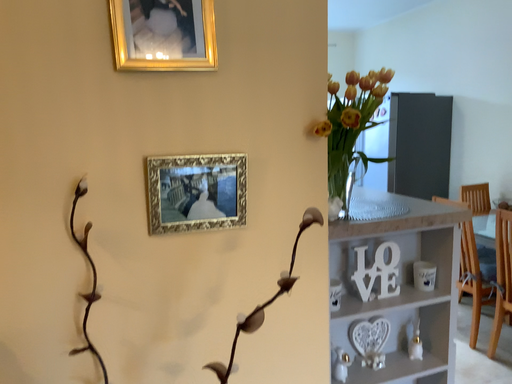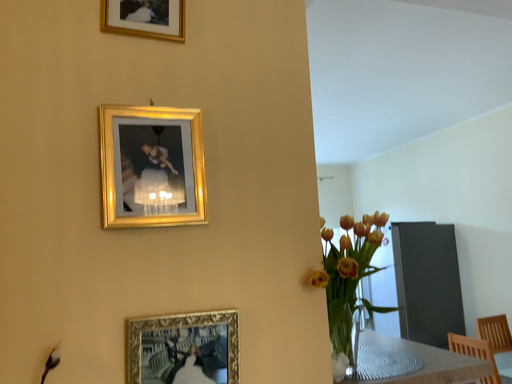
Question: How did the camera likely rotate when shooting the video?

Choices:
 (A) rotated downward
 (B) rotated upward

Answer: (B)